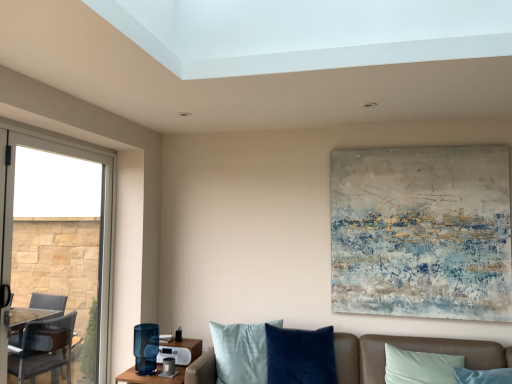
Where is `free space above clear glass window at left (from a real-world perspective)`? This screenshot has width=512, height=384. free space above clear glass window at left (from a real-world perspective) is located at coordinates (71, 146).